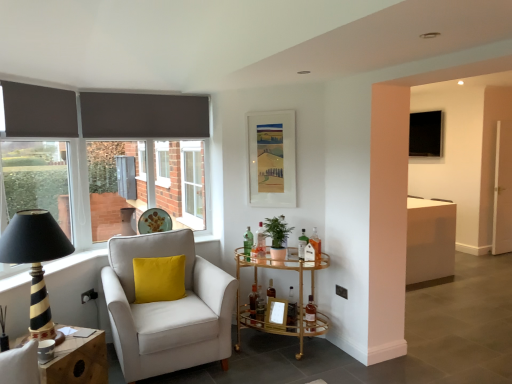
Question: Is clear glass bottle at center, arranged as the fourth bottle when viewed from the left, next to translucent amber glass bottle at center, which is counted as the second bottle, starting from the right?

Choices:
 (A) yes
 (B) no

Answer: (B)

Question: Does clear glass bottle at center, arranged as the fourth bottle when viewed from the left, have a smaller size compared to translucent amber glass bottle at center, which is counted as the second bottle, starting from the right?

Choices:
 (A) no
 (B) yes

Answer: (A)

Question: Considering the relative positions of clear glass bottle at center, the fourth bottle positioned from the right, and translucent amber glass bottle at center, which is counted as the second bottle, starting from the right, in the image provided, is clear glass bottle at center, the fourth bottle positioned from the right, to the right of translucent amber glass bottle at center, which is counted as the second bottle, starting from the right, from the viewer's perspective?

Choices:
 (A) no
 (B) yes

Answer: (A)

Question: From the image's perspective, is clear glass bottle at center, the fourth bottle positioned from the right, located above translucent amber glass bottle at center, the 6th bottle viewed from the left?

Choices:
 (A) no
 (B) yes

Answer: (B)

Question: Can you confirm if clear glass bottle at center, arranged as the fourth bottle when viewed from the left, is bigger than translucent amber glass bottle at center, the 6th bottle viewed from the left?

Choices:
 (A) no
 (B) yes

Answer: (B)

Question: Is clear glass bottle at center, arranged as the fourth bottle when viewed from the left, oriented towards translucent amber glass bottle at center, the 6th bottle viewed from the left?

Choices:
 (A) no
 (B) yes

Answer: (A)

Question: Is green matte plant at center smaller than gold glass bar cart at center, the 2th table positioned from the left?

Choices:
 (A) yes
 (B) no

Answer: (A)

Question: From the image's perspective, does green matte plant at center appear lower than gold glass bar cart at center, positioned as the first table in right-to-left order?

Choices:
 (A) no
 (B) yes

Answer: (A)

Question: Can you confirm if green matte plant at center is bigger than gold glass bar cart at center, the 2th table positioned from the left?

Choices:
 (A) yes
 (B) no

Answer: (B)

Question: Is green matte plant at center outside of gold glass bar cart at center, the 2th table positioned from the left?

Choices:
 (A) no
 (B) yes

Answer: (B)

Question: From a real-world perspective, is green matte plant at center beneath gold glass bar cart at center, positioned as the first table in right-to-left order?

Choices:
 (A) yes
 (B) no

Answer: (B)

Question: Can you confirm if green matte plant at center is thinner than gold glass bar cart at center, positioned as the first table in right-to-left order?

Choices:
 (A) yes
 (B) no

Answer: (A)

Question: From the image's perspective, is green glass bottle at center, the 3th bottle when ordered from left to right, below white plastic window frame at center?

Choices:
 (A) yes
 (B) no

Answer: (A)